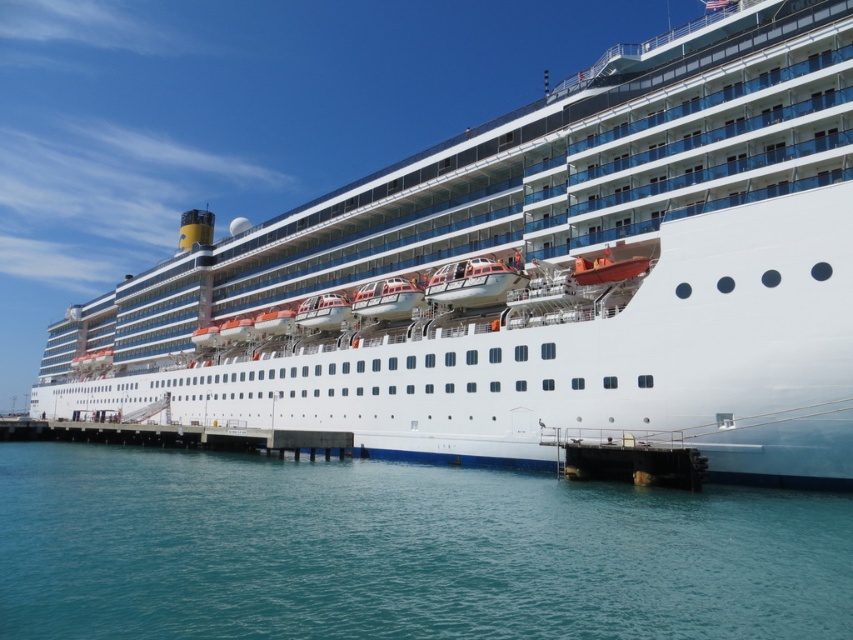
Which is more to the right, white glossy cruise ship at center or white concrete dock at lower center?

white glossy cruise ship at center is more to the right.

Can you confirm if white glossy cruise ship at center is thinner than white concrete dock at lower center?

In fact, white glossy cruise ship at center might be wider than white concrete dock at lower center.

The height and width of the screenshot is (640, 853). What do you see at coordinates (538, 282) in the screenshot?
I see `white glossy cruise ship at center` at bounding box center [538, 282].

Locate an element on the screen. This screenshot has width=853, height=640. white glossy cruise ship at center is located at coordinates (538, 282).

Is clear blue water at lower center below white concrete dock at lower center?

No, clear blue water at lower center is not below white concrete dock at lower center.

Can you confirm if clear blue water at lower center is positioned to the right of white concrete dock at lower center?

Yes, clear blue water at lower center is to the right of white concrete dock at lower center.

Is point (370, 502) more distant than point (283, 442)?

That is False.

In order to click on clear blue water at lower center in this screenshot , I will do `click(399, 552)`.

Can you confirm if white glossy cruise ship at center is positioned above clear blue water at lower center?

Indeed, white glossy cruise ship at center is positioned over clear blue water at lower center.

Does white glossy cruise ship at center have a greater width compared to clear blue water at lower center?

Yes, white glossy cruise ship at center is wider than clear blue water at lower center.

Is point (421, 241) closer to viewer compared to point (125, 500)?

No, it is behind (125, 500).

Locate an element on the screen. The height and width of the screenshot is (640, 853). white glossy cruise ship at center is located at coordinates (538, 282).